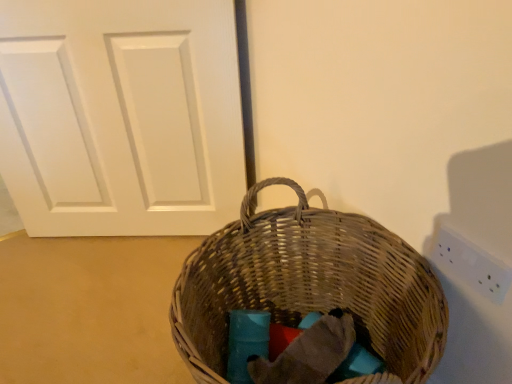
Question: Would you say white plastic electric outlet at upper right is inside or outside woven brown picnic basket at center?

Choices:
 (A) inside
 (B) outside

Answer: (B)

Question: Is point (481, 268) closer or farther from the camera than point (202, 261)?

Choices:
 (A) farther
 (B) closer

Answer: (B)

Question: Estimate the real-world distances between objects in this image. Which object is closer to the white matte door at center?

Choices:
 (A) white plastic electric outlet at upper right
 (B) woven brown picnic basket at center

Answer: (B)

Question: Estimate the real-world distances between objects in this image. Which object is closer to the woven brown picnic basket at center?

Choices:
 (A) white matte door at center
 (B) white plastic electric outlet at upper right

Answer: (B)